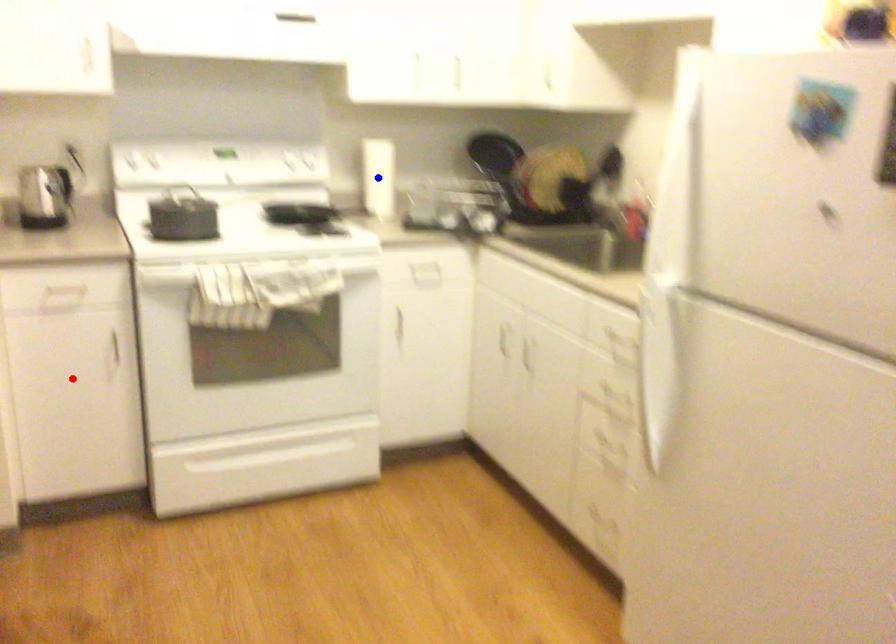
Question: In the image, two points are highlighted. Which point is nearer to the camera? Reply with the corresponding letter.

Choices:
 (A) blue point
 (B) red point

Answer: (B)